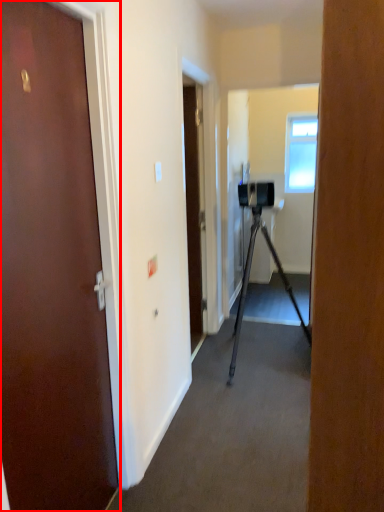
Question: From the image, what is the correct spatial relationship of door (annotated by the red box) in relation to window?

Choices:
 (A) left
 (B) right

Answer: (A)